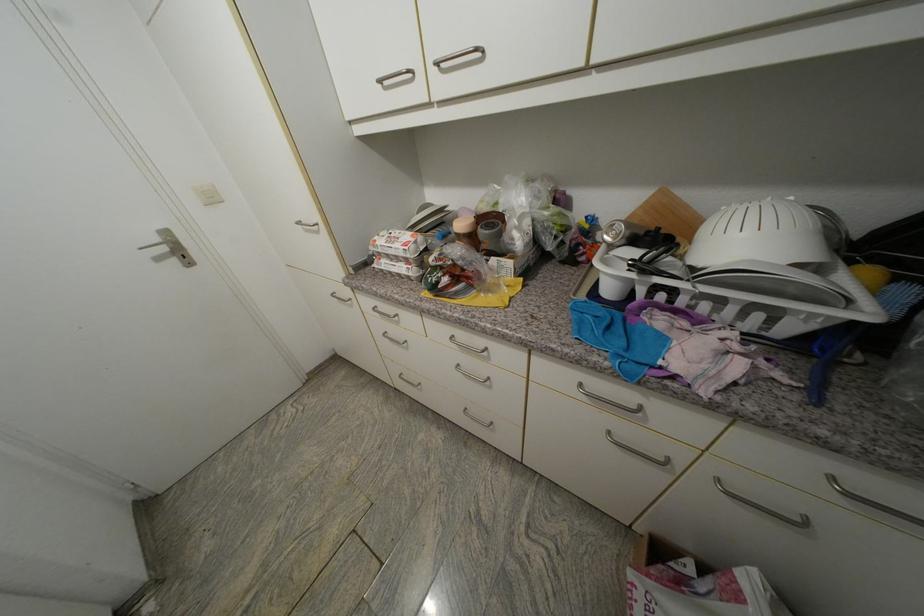
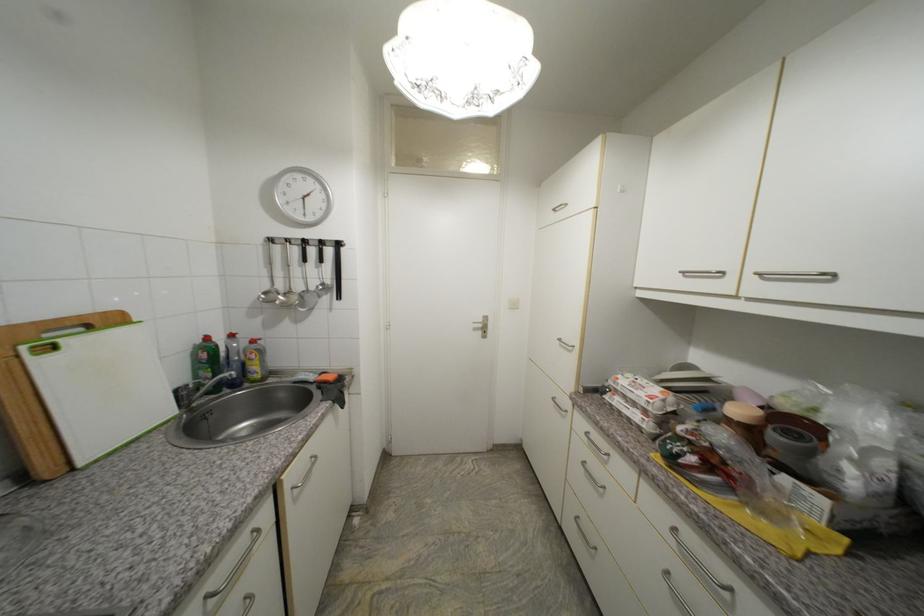
Where in the second image is the point corresponding to point 387,269 from the first image?

(619, 405)